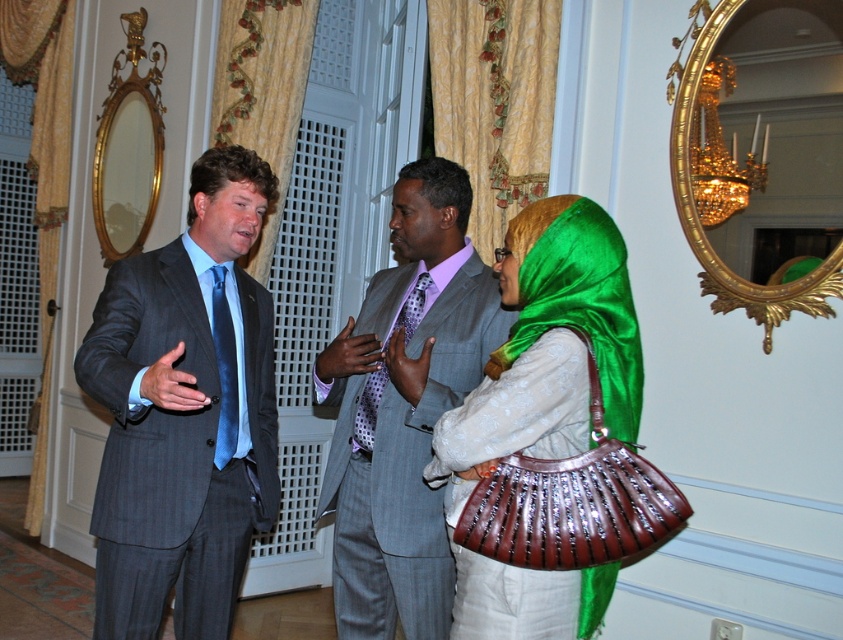
Question: Which point is farther to the camera?

Choices:
 (A) (584, 276)
 (B) (368, 442)

Answer: (B)

Question: Which object appears farthest from the camera in this image?

Choices:
 (A) dark gray pinstripe suit at center
 (B) gray pinstripe suit at center
 (C) purple dotted tie at center
 (D) shiny green fabric headscarf at center

Answer: (C)

Question: Can you confirm if shiny green fabric headscarf at center is positioned above purple dotted tie at center?

Choices:
 (A) yes
 (B) no

Answer: (B)

Question: Which point is farther from the camera taking this photo?

Choices:
 (A) (229, 456)
 (B) (415, 308)
 (C) (400, 397)

Answer: (B)

Question: Is dark gray pinstripe suit at center bigger than blue silk tie at left?

Choices:
 (A) no
 (B) yes

Answer: (B)

Question: Does dark gray pinstripe suit at center have a larger size compared to blue silk tie at left?

Choices:
 (A) yes
 (B) no

Answer: (A)